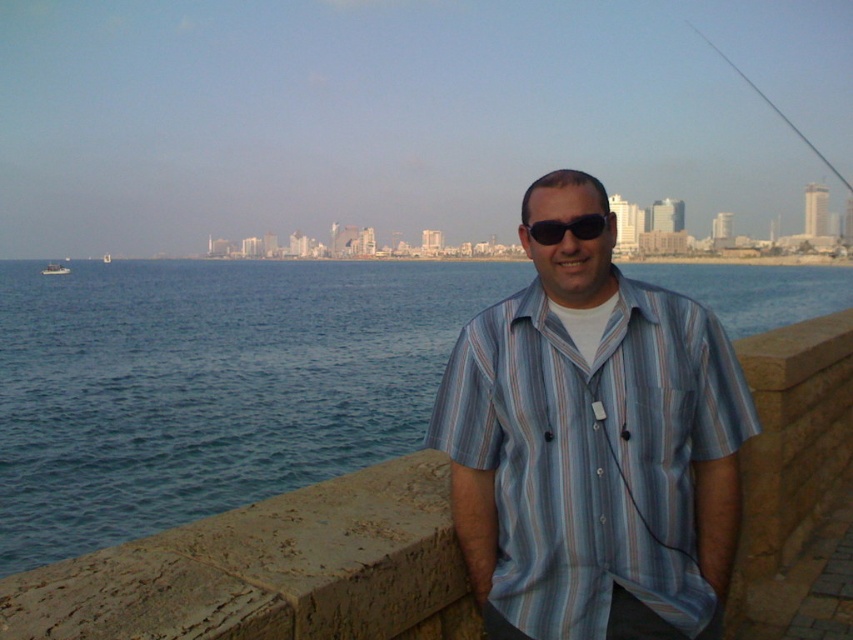
Does metallic fishing pole at upper right appear under white plastic boat at left?

Actually, metallic fishing pole at upper right is above white plastic boat at left.

Can you confirm if metallic fishing pole at upper right is smaller than white plastic boat at left?

Incorrect, metallic fishing pole at upper right is not smaller in size than white plastic boat at left.

At what (x,y) coordinates should I click in order to perform the action: click on metallic fishing pole at upper right. Please return your answer as a coordinate pair (x, y). The height and width of the screenshot is (640, 853). Looking at the image, I should click on (773, 108).

Can you confirm if blue striped shirt at center is thinner than white plastic boat at left?

Yes.

In the scene shown: Does blue striped shirt at center appear on the right side of white plastic boat at left?

Indeed, blue striped shirt at center is positioned on the right side of white plastic boat at left.

Is point (712, 349) positioned behind point (47, 272)?

That is False.

Locate an element on the screen. Image resolution: width=853 pixels, height=640 pixels. blue striped shirt at center is located at coordinates (592, 444).

What do you see at coordinates (209, 385) in the screenshot? I see `blue water at center` at bounding box center [209, 385].

Is blue water at center further to camera compared to white plastic boat at left?

No.

Is point (35, 268) in front of point (55, 262)?

Yes.

At what (x,y) coordinates should I click in order to perform the action: click on blue water at center. Please return your answer as a coordinate pair (x, y). This screenshot has height=640, width=853. Looking at the image, I should click on (209, 385).